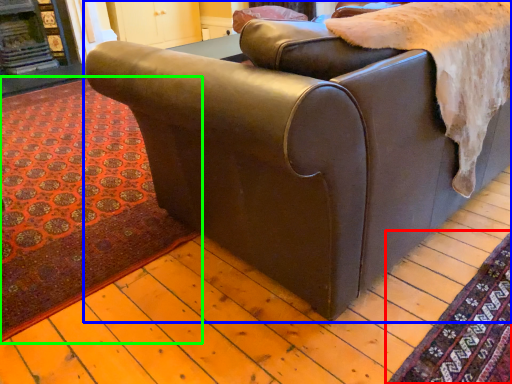
Question: Estimate the real-world distances between objects in this image. Which object is closer to mat (highlighted by a red box), studio couch (highlighted by a blue box) or mat (highlighted by a green box)?

Choices:
 (A) studio couch
 (B) mat

Answer: (A)